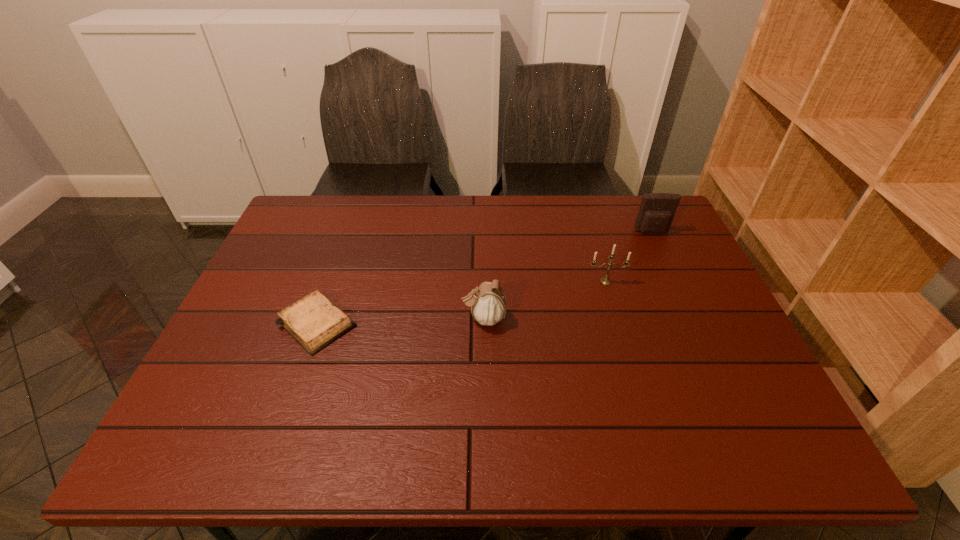
The width and height of the screenshot is (960, 540). I want to click on the farther pouch, so click(x=657, y=210).

This screenshot has height=540, width=960. I want to click on the right pouch, so click(657, 210).

Where is `the second farthest object`? the second farthest object is located at coordinates (605, 280).

Locate an element on the screen. The height and width of the screenshot is (540, 960). candle is located at coordinates (605, 280).

The width and height of the screenshot is (960, 540). Identify the location of the left pouch. (488, 303).

You are a GUI agent. You are given a task and a screenshot of the screen. Output one action in this format:
    pyautogui.click(x=<x>, y=<y>)
    Task: Click on the third object from right to left
    This screenshot has width=960, height=540.
    Given the screenshot: What is the action you would take?
    pyautogui.click(x=488, y=303)

At what (x,y) coordinates should I click in order to perform the action: click on diary. Please return your answer as a coordinate pair (x, y). The image size is (960, 540). Looking at the image, I should click on (314, 321).

This screenshot has width=960, height=540. I want to click on the leftmost object, so click(314, 321).

Identify the location of free region located 0.340m with an open flap on the rightmost object. The height and width of the screenshot is (540, 960). (692, 318).

The width and height of the screenshot is (960, 540). What are the coordinates of `free spot located on the right of the second farthest object` in the screenshot? It's located at (657, 281).